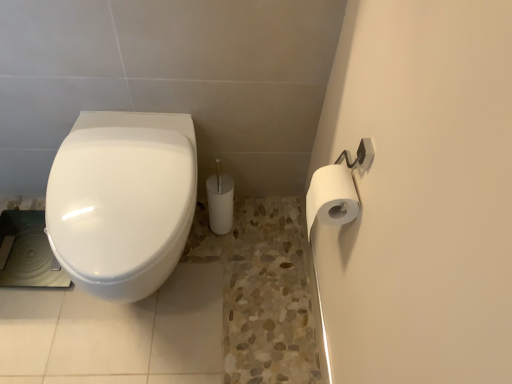
Question: Is white matte toilet paper at upper right to the left or to the right of white glossy toilet at left in the image?

Choices:
 (A) left
 (B) right

Answer: (B)

Question: In the image, is white matte toilet paper at upper right positioned in front of or behind white glossy toilet at left?

Choices:
 (A) behind
 (B) front

Answer: (B)

Question: From a real-world perspective, is white matte toilet paper at upper right above or below white glossy toilet at left?

Choices:
 (A) above
 (B) below

Answer: (A)

Question: In the image, is white glossy toilet at left on the left side or the right side of white matte toilet paper at upper right?

Choices:
 (A) left
 (B) right

Answer: (A)

Question: From the image's perspective, relative to white matte toilet paper at upper right, is white glossy toilet at left above or below?

Choices:
 (A) above
 (B) below

Answer: (B)

Question: In terms of width, does white glossy toilet at left look wider or thinner when compared to white matte toilet paper at upper right?

Choices:
 (A) wide
 (B) thin

Answer: (A)

Question: From a real-world perspective, is white glossy toilet at left positioned above or below white matte toilet paper at upper right?

Choices:
 (A) below
 (B) above

Answer: (A)